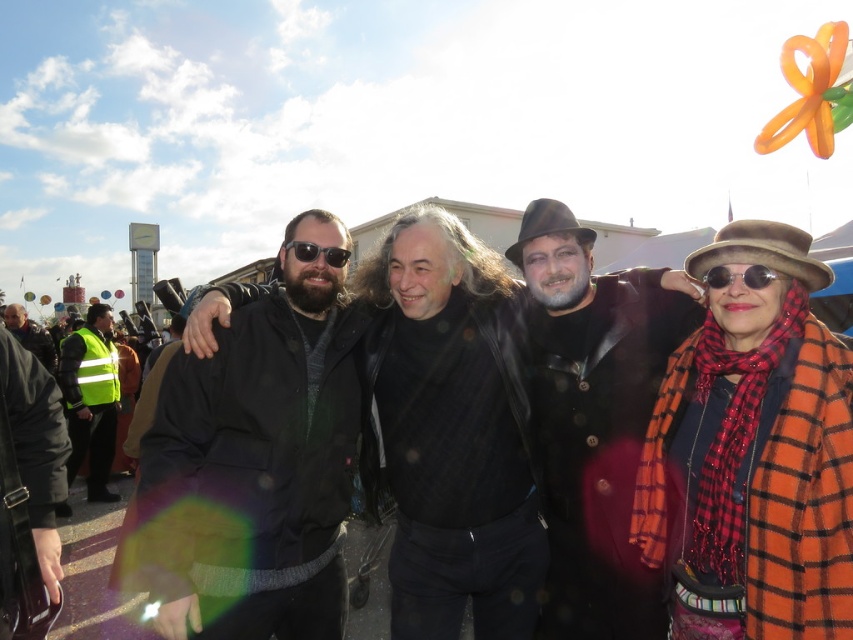
You are a photographer standing at the camera position. You want to take a closeup shot of the black matte jacket at left. Given that your camera has a maximum zoom range of 50 meters, can you capture the jacket clearly?

The black matte jacket at left is 34.41 meters away from the camera. Since the camera can zoom up to 50 meters, you can capture the jacket clearly.

You are trying to decide which jacket to choose for a casual day out. Based on the image, which jacket is bigger between the black matte jacket at left and the black leather jacket at center?

The black matte jacket at left is larger in size compared to the black leather jacket at center, so the black matte jacket at left is bigger.

You are a photographer standing 10 meters away from the black leather jacket at center. You want to take a photo of the black matte jacket at left. Can you fit both jackets into your camera frame if your camera has a maximum range of 20 meters?

The black matte jacket at left is 16.00 meters from the black leather jacket at center. Since you are 10 meters away from the black leather jacket at center, the black matte jacket at left is 26.00 meters away from you. The camera can only capture up to 20 meters, so both jackets cannot be in the same frame.